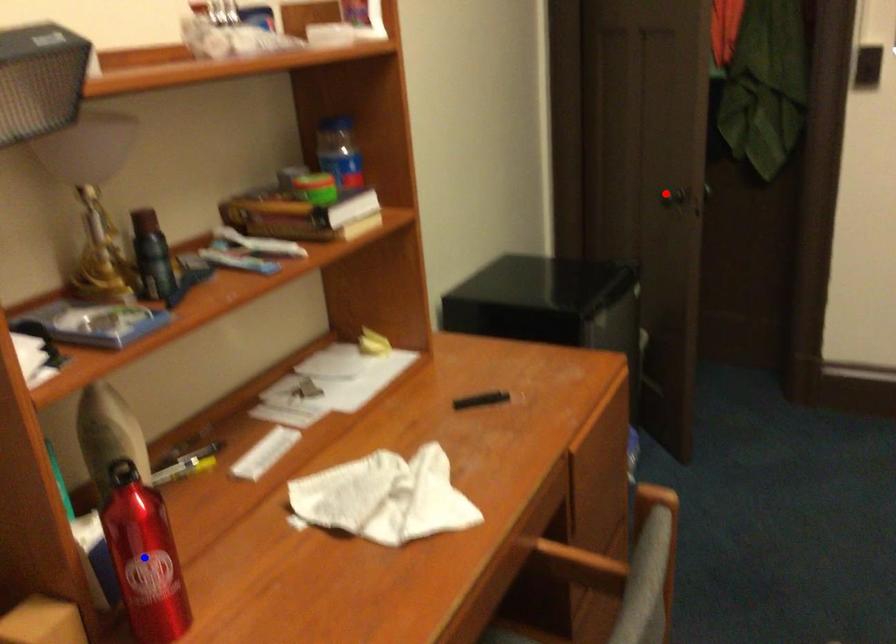
Question: In the image, two points are highlighted. Which point is nearer to the camera? Reply with the corresponding letter.

Choices:
 (A) blue point
 (B) red point

Answer: (A)